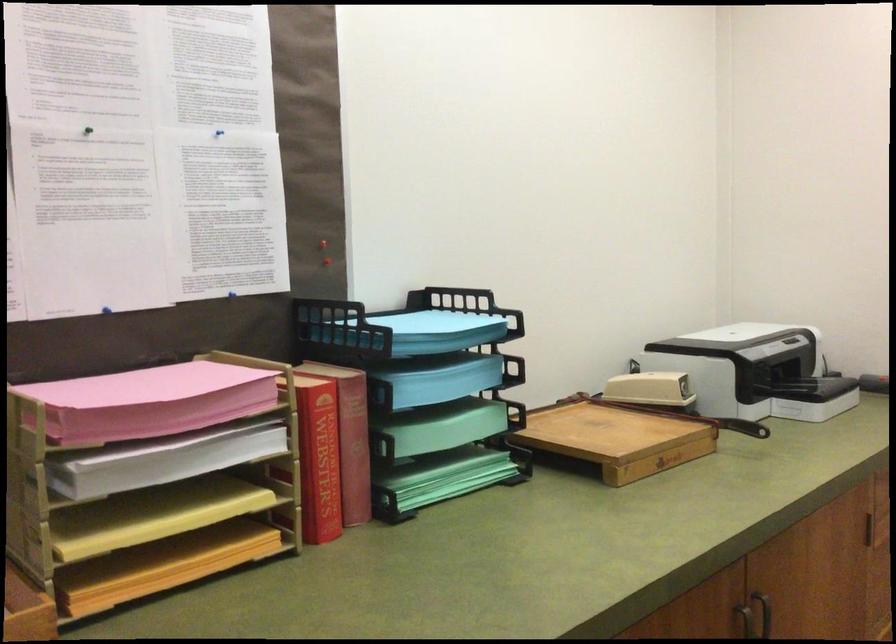
Find the location of `pink paper stack`. pink paper stack is located at coordinates (171, 406).